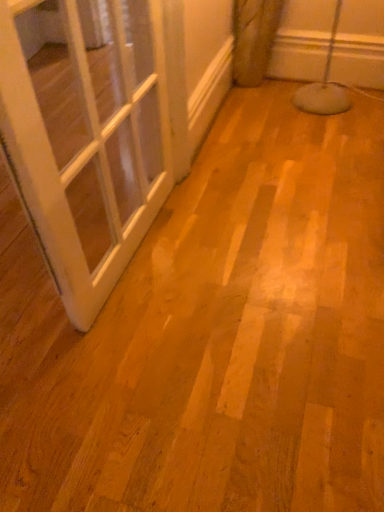
What is the approximate width of white wood door at left?

11.09 centimeters.

At what (x,y) coordinates should I click in order to perform the action: click on white wood door at left. Please return your answer as a coordinate pair (x, y). Image resolution: width=384 pixels, height=512 pixels. Looking at the image, I should click on (88, 145).

Describe the element at coordinates (88, 145) in the screenshot. I see `white wood door at left` at that location.

The image size is (384, 512). Find the location of `white wood door at left`. white wood door at left is located at coordinates (88, 145).